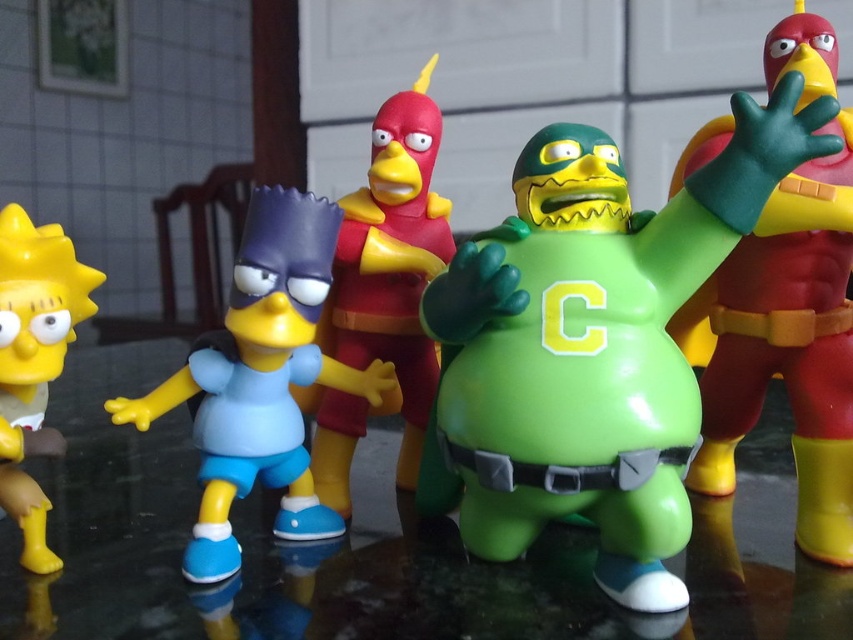
Question: Among these objects, which one is nearest to the camera?

Choices:
 (A) shiny red plastic bird at center
 (B) light blue plastic bart simpson at center

Answer: (B)

Question: Is green matte figure at center closer to the viewer compared to shiny red and yellow figure at center right?

Choices:
 (A) yes
 (B) no

Answer: (A)

Question: In this image, where is green matte figure at center located relative to shiny red plastic bird at center?

Choices:
 (A) below
 (B) above

Answer: (A)

Question: Among these points, which one is farthest from the camera?

Choices:
 (A) 793,280
 (B) 601,330
 (C) 651,486

Answer: (A)

Question: Which point is farther from the camera taking this photo?

Choices:
 (A) (405, 312)
 (B) (312, 280)

Answer: (A)

Question: Is shiny red and yellow figure at center right bigger than light blue plastic bart simpson at center?

Choices:
 (A) yes
 (B) no

Answer: (A)